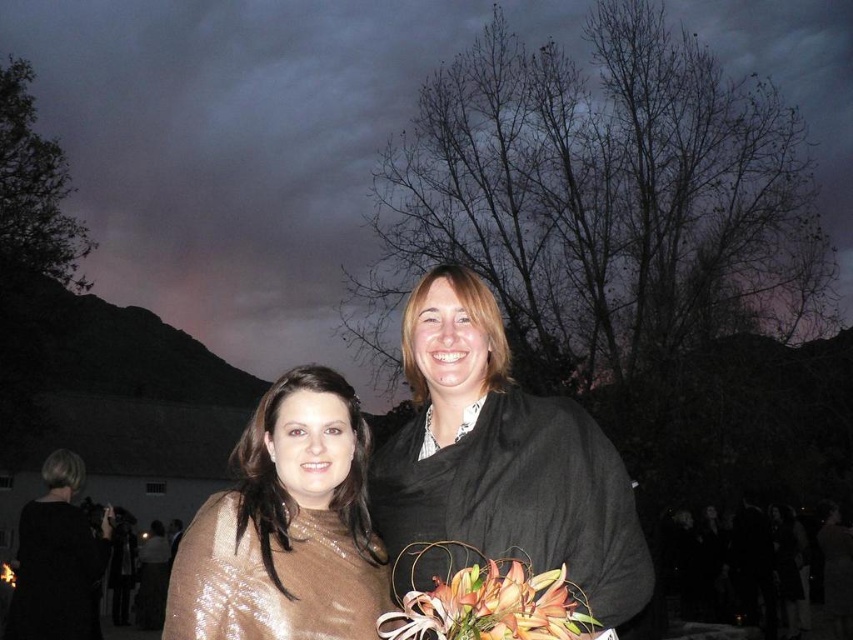
In the scene shown: You are a photographer adjusting your camera settings to focus on the black matte dress at center. What are the coordinates you should set to ensure the dress is centered in the frame?

The coordinates to center the black matte dress at center should be set to point (502, 467).

Based on the photo, you are a photographer setting up for an outdoor evening shoot. You notice two shiny gold dresses in the scene. Which one is taller, the shiny gold dress at center or the shiny gold dress at lower left?

The shiny gold dress at center is taller than the shiny gold dress at lower left according to the description.